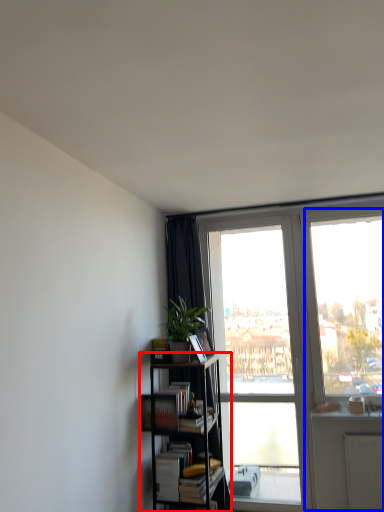
Question: Among these objects, which one is nearest to the camera, bookcase (highlighted by a red box) or glass door (highlighted by a blue box)?

Choices:
 (A) bookcase
 (B) glass door

Answer: (A)